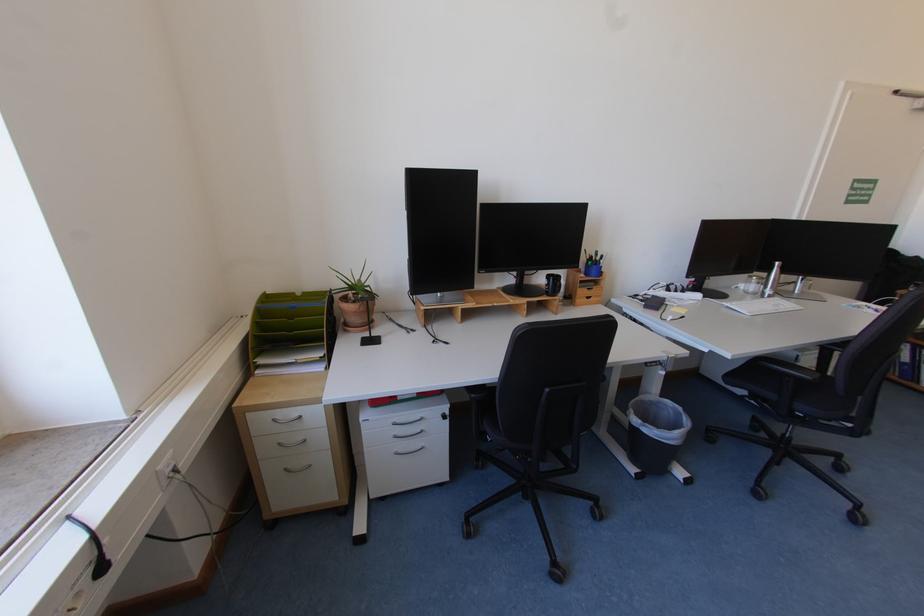
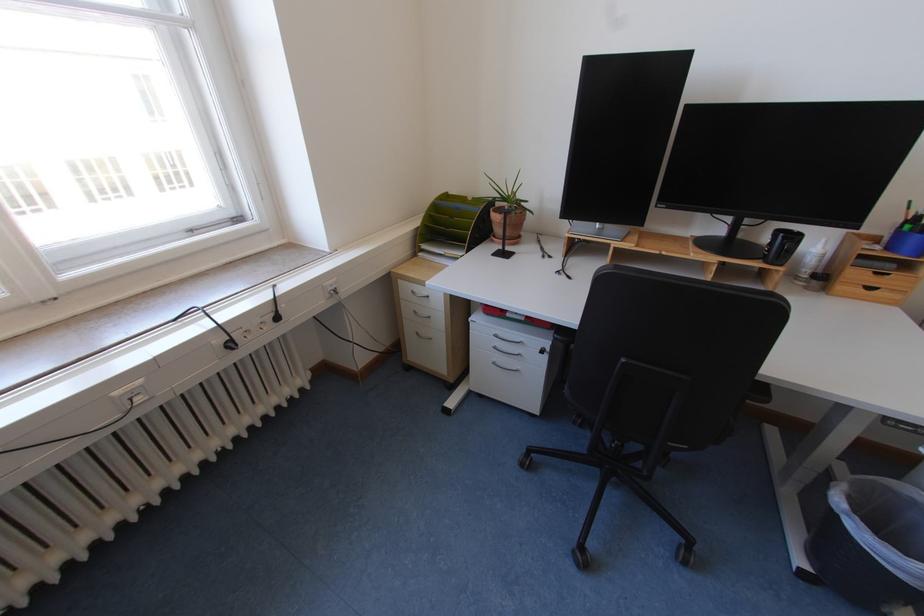
Locate, in the second image, the point that corresponds to (294,469) in the first image.

(426, 334)